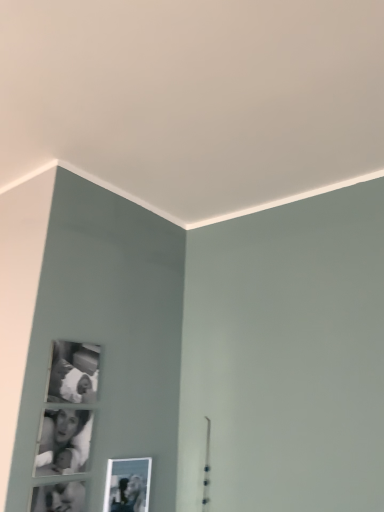
This screenshot has height=512, width=384. I want to click on black glossy photo frame at lower left, so click(64, 441).

Image resolution: width=384 pixels, height=512 pixels. I want to click on metallic silver photo frame at lower center, which appears as the first picture frame when viewed from the right, so click(x=127, y=485).

Is black matte photo frame at upper left, which is the 2th picture frame in bottom-to-top order, inside black glossy photo frame at lower left?

No, black matte photo frame at upper left, which is the 2th picture frame in bottom-to-top order, is not a part of black glossy photo frame at lower left.

Which object is more forward, black glossy photo frame at lower left or black matte photo frame at upper left, which is the 2th picture frame in bottom-to-top order?

black glossy photo frame at lower left is in front.

From the picture: Can you see black glossy photo frame at lower left touching black matte photo frame at upper left, positioned as the 1th picture frame in top-to-bottom order?

No, black glossy photo frame at lower left is not making contact with black matte photo frame at upper left, positioned as the 1th picture frame in top-to-bottom order.

In the scene shown: From the image's perspective, which object appears higher, black glossy photo frame at lower left or black matte photo frame at upper left, which is the 2th picture frame in bottom-to-top order?

black matte photo frame at upper left, which is the 2th picture frame in bottom-to-top order, is shown above in the image.

From the picture: Can you tell me how much metallic silver photo frame at lower center, the first picture frame in the bottom-to-top sequence, and black glossy photo frame at lower left differ in facing direction?

metallic silver photo frame at lower center, the first picture frame in the bottom-to-top sequence, and black glossy photo frame at lower left are facing 0.819 degrees away from each other.

Could you tell me if metallic silver photo frame at lower center, the second picture frame in the left-to-right sequence, is turned towards black glossy photo frame at lower left?

No.

Identify the location of picture frame below the black glossy photo frame at lower left (from the image's perspective). [x=127, y=485].

Which of these two, metallic silver photo frame at lower center, the second picture frame in the left-to-right sequence, or black glossy photo frame at lower left, is thinner?

black glossy photo frame at lower left is thinner.

From a real-world perspective, is black glossy photo frame at lower left below metallic silver photo frame at lower center, the second picture frame in the left-to-right sequence?

Incorrect, from a real-world perspective, black glossy photo frame at lower left is higher than metallic silver photo frame at lower center, the second picture frame in the left-to-right sequence.

Is black glossy photo frame at lower left thinner than metallic silver photo frame at lower center, the first picture frame in the bottom-to-top sequence?

Indeed, black glossy photo frame at lower left has a lesser width compared to metallic silver photo frame at lower center, the first picture frame in the bottom-to-top sequence.

In the image, there is a black glossy photo frame at lower left. Where is `picture frame below it (from the image's perspective)`? This screenshot has width=384, height=512. picture frame below it (from the image's perspective) is located at coordinates (127, 485).

Based on the photo, between black matte photo frame at upper left, which is the 2th picture frame in bottom-to-top order, and black glossy photo frame at lower left, which one has smaller width?

black matte photo frame at upper left, which is the 2th picture frame in bottom-to-top order, is thinner.

In the image, is black matte photo frame at upper left, arranged as the first picture frame when viewed from the left, on the left side or the right side of black glossy photo frame at lower left?

Based on their positions, black matte photo frame at upper left, arranged as the first picture frame when viewed from the left, is located to the right of black glossy photo frame at lower left.

In terms of size, does black matte photo frame at upper left, which is the 2th picture frame in bottom-to-top order, appear bigger or smaller than black glossy photo frame at lower left?

In the image, black matte photo frame at upper left, which is the 2th picture frame in bottom-to-top order, appears to be larger than black glossy photo frame at lower left.

Does point (76, 373) appear closer or farther from the camera than point (80, 459)?

Point (76, 373) is positioned farther from the camera compared to point (80, 459).

Is point (142, 501) more distant than point (89, 349)?

Yes, point (142, 501) is farther from viewer.

Is metallic silver photo frame at lower center, the second picture frame in the left-to-right sequence, outside of black matte photo frame at upper left, positioned as the 1th picture frame in top-to-bottom order?

metallic silver photo frame at lower center, the second picture frame in the left-to-right sequence, is positioned outside black matte photo frame at upper left, positioned as the 1th picture frame in top-to-bottom order.

This screenshot has height=512, width=384. In order to click on picture frame that is behind the black matte photo frame at upper left, positioned as the 1th picture frame in top-to-bottom order in this screenshot , I will do `click(127, 485)`.

From a real-world perspective, does metallic silver photo frame at lower center, the second picture frame in the left-to-right sequence, sit lower than black matte photo frame at upper left, arranged as the first picture frame when viewed from the left?

Yes, from a real-world perspective, metallic silver photo frame at lower center, the second picture frame in the left-to-right sequence, is below black matte photo frame at upper left, arranged as the first picture frame when viewed from the left.

Considering the sizes of objects black matte photo frame at upper left, arranged as the first picture frame when viewed from the left, and metallic silver photo frame at lower center, the second picture frame in the left-to-right sequence, in the image provided, who is thinner, black matte photo frame at upper left, arranged as the first picture frame when viewed from the left, or metallic silver photo frame at lower center, the second picture frame in the left-to-right sequence,?

With smaller width is black matte photo frame at upper left, arranged as the first picture frame when viewed from the left.

Which object is further away from the camera, black matte photo frame at upper left, arranged as the 2th picture frame when viewed from the right, or metallic silver photo frame at lower center, which appears as the first picture frame when viewed from the right?

metallic silver photo frame at lower center, which appears as the first picture frame when viewed from the right, is further from the camera.

Is black matte photo frame at upper left, arranged as the first picture frame when viewed from the left, positioned beyond the bounds of metallic silver photo frame at lower center, which appears as the second picture frame when viewed from the top?

That's correct, black matte photo frame at upper left, arranged as the first picture frame when viewed from the left, is outside of metallic silver photo frame at lower center, which appears as the second picture frame when viewed from the top.

Considering the relative sizes of black matte photo frame at upper left, positioned as the 1th picture frame in top-to-bottom order, and metallic silver photo frame at lower center, which appears as the second picture frame when viewed from the top, in the image provided, is black matte photo frame at upper left, positioned as the 1th picture frame in top-to-bottom order, taller than metallic silver photo frame at lower center, which appears as the second picture frame when viewed from the top,?

Incorrect, the height of black matte photo frame at upper left, positioned as the 1th picture frame in top-to-bottom order, is not larger of that of metallic silver photo frame at lower center, which appears as the second picture frame when viewed from the top.

Where is `picture frame that is the 1st object located behind the black glossy photo frame at lower left`? picture frame that is the 1st object located behind the black glossy photo frame at lower left is located at coordinates (74, 373).

Find the location of `couple on the left of metallic silver photo frame at lower center, the first picture frame in the bottom-to-top sequence`. couple on the left of metallic silver photo frame at lower center, the first picture frame in the bottom-to-top sequence is located at coordinates (64, 441).

Consider the image. Which object lies further to the anchor point black matte photo frame at upper left, which is the 2th picture frame in bottom-to-top order, metallic silver photo frame at lower center, which appears as the first picture frame when viewed from the right, or black glossy photo frame at lower left?

The object further to black matte photo frame at upper left, which is the 2th picture frame in bottom-to-top order, is metallic silver photo frame at lower center, which appears as the first picture frame when viewed from the right.

Looking at the image, which one is located closer to metallic silver photo frame at lower center, the second picture frame in the left-to-right sequence, black matte photo frame at upper left, positioned as the 1th picture frame in top-to-bottom order, or black glossy photo frame at lower left?

Based on the image, black glossy photo frame at lower left appears to be nearer to metallic silver photo frame at lower center, the second picture frame in the left-to-right sequence.

Considering their positions, is black matte photo frame at upper left, positioned as the 1th picture frame in top-to-bottom order, positioned closer to black glossy photo frame at lower left than metallic silver photo frame at lower center, the second picture frame in the left-to-right sequence?

black matte photo frame at upper left, positioned as the 1th picture frame in top-to-bottom order.

Based on their spatial positions, is metallic silver photo frame at lower center, which appears as the second picture frame when viewed from the top, or black matte photo frame at upper left, positioned as the 1th picture frame in top-to-bottom order, closer to black glossy photo frame at lower left?

black matte photo frame at upper left, positioned as the 1th picture frame in top-to-bottom order.

From the image, which object appears to be nearer to black matte photo frame at upper left, arranged as the 2th picture frame when viewed from the right, black glossy photo frame at lower left or metallic silver photo frame at lower center, the first picture frame in the bottom-to-top sequence?

black glossy photo frame at lower left is positioned closer to the anchor black matte photo frame at upper left, arranged as the 2th picture frame when viewed from the right.

Which object lies further to the anchor point metallic silver photo frame at lower center, the first picture frame in the bottom-to-top sequence, black glossy photo frame at lower left or black matte photo frame at upper left, which is the 2th picture frame in bottom-to-top order?

Among the two, black matte photo frame at upper left, which is the 2th picture frame in bottom-to-top order, is located further to metallic silver photo frame at lower center, the first picture frame in the bottom-to-top sequence.

The width and height of the screenshot is (384, 512). I want to click on couple between black matte photo frame at upper left, which is the 2th picture frame in bottom-to-top order, and metallic silver photo frame at lower center, the first picture frame in the bottom-to-top sequence, from top to bottom, so click(x=64, y=441).